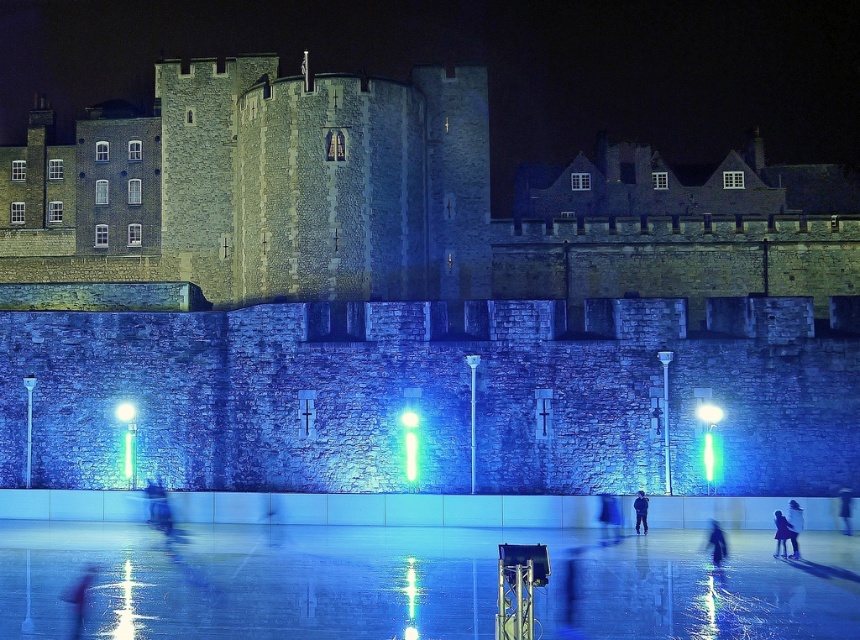
You are standing at the center of the ice rink in front of the Tower of London. You want to take a photo of the stone wall at center. Where should you aim your camera to capture it in the frame?

You should aim your camera at point (387, 200) to capture the stone wall at center in the frame.

You are at the Tower of London ice rink and want to find a specific dark blue fabric jacket at lower right. You see a dark blue fabric coat at lower right nearby. How far apart are the jacket and coat?

The dark blue fabric jacket at lower right is 3.27 meters away from the dark blue fabric coat at lower right.